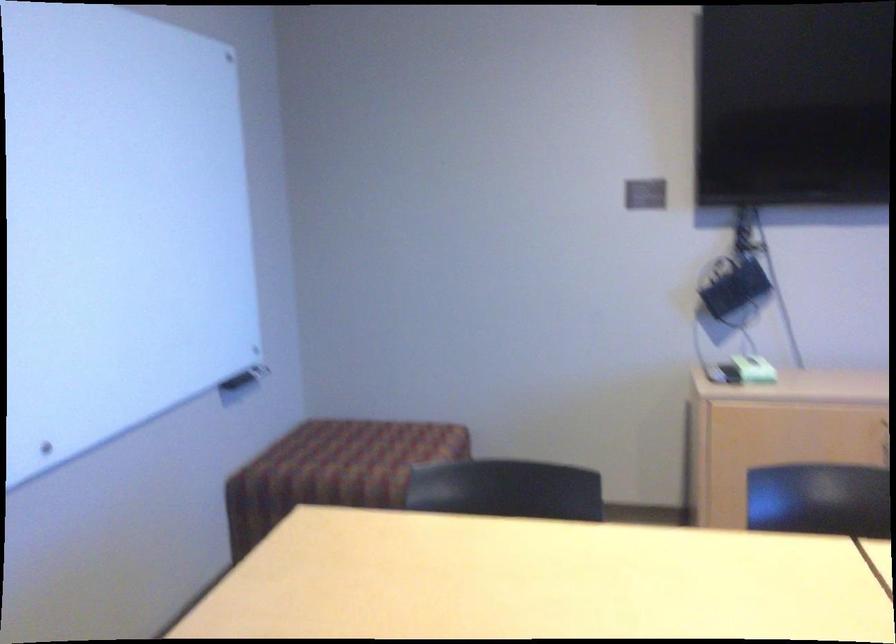
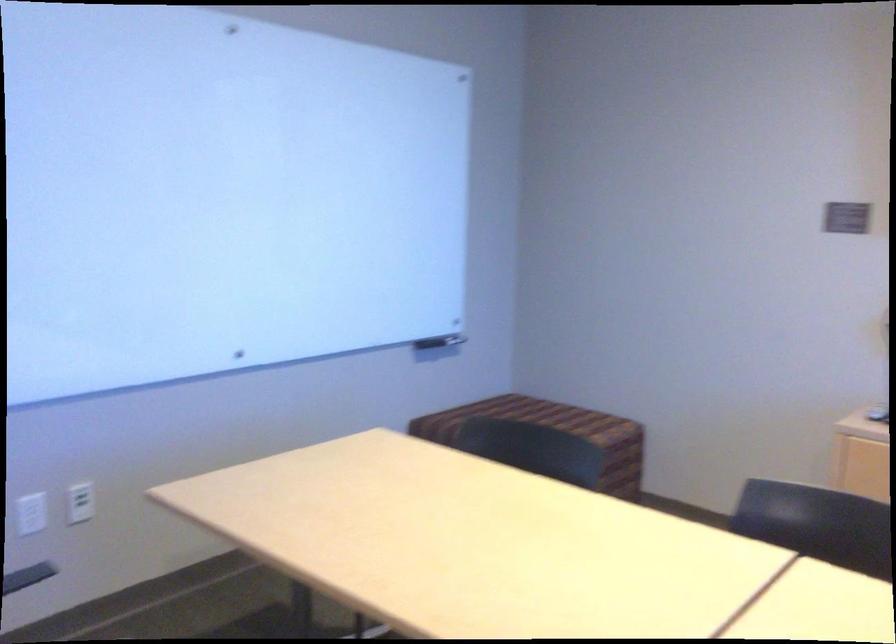
Question: Based on the continuous images, in which direction is the camera rotating? Reply with the corresponding letter.

Choices:
 (A) Left
 (B) Right
 (C) Up
 (D) Down

Answer: (A)